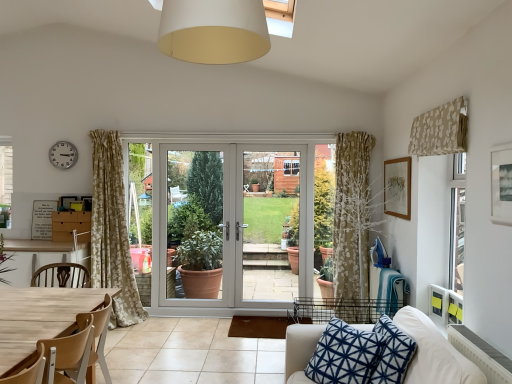
Question: Is matte white screen door at center, arranged as the 3th screen door when viewed from the right, taller or shorter than white glossy door at center, which appears as the 1th screen door when viewed from the right?

Choices:
 (A) short
 (B) tall

Answer: (A)

Question: In terms of width, does matte white screen door at center, arranged as the 3th screen door when viewed from the right, look wider or thinner when compared to white glossy door at center, which appears as the 1th screen door when viewed from the right?

Choices:
 (A) wide
 (B) thin

Answer: (A)

Question: Which is nearer to the matte white screen door at center, arranged as the 3th screen door when viewed from the right?

Choices:
 (A) white matte lampshade at upper center
 (B) wooden picture frame at upper right, arranged as the second picture frame when viewed from the front
 (C) blue printed cushion at lower right
 (D) light brown wood chair at lower left
 (E) white glossy door at center, marked as the 3th screen door in a left-to-right arrangement

Answer: (E)

Question: Based on their relative distances, which object is nearer to the white matte lampshade at upper center?

Choices:
 (A) beige floral fabric at upper right
 (B) matte black picture frame at upper right, which ranks as the 1th picture frame in left-to-right order
 (C) white plastic clock at upper left
 (D) white glossy door at center, marked as the 3th screen door in a left-to-right arrangement
 (E) wooden picture frame at upper right, acting as the 2th picture frame starting from the left

Answer: (A)